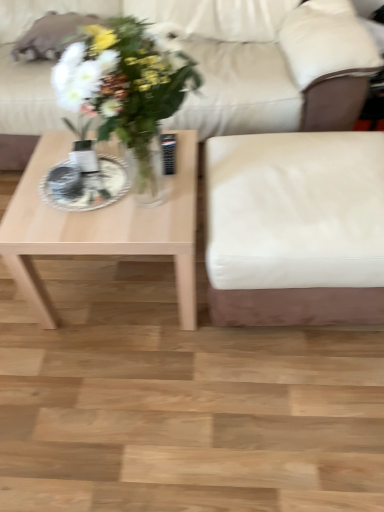
Question: From the image's perspective, is light wood coffee table at left above or below white glossy plate at center?

Choices:
 (A) below
 (B) above

Answer: (A)

Question: Choose the correct answer: Is light wood coffee table at left inside white glossy plate at center or outside it?

Choices:
 (A) outside
 (B) inside

Answer: (A)

Question: Estimate the real-world distances between objects in this image. Which object is farther from the white leather armchair at right?

Choices:
 (A) light wood coffee table at left
 (B) white glossy plate at center
 (C) beige leather couch at center

Answer: (C)

Question: Which object is the farthest from the white glossy plate at center?

Choices:
 (A) white leather armchair at right
 (B) light wood coffee table at left
 (C) beige leather couch at center

Answer: (C)